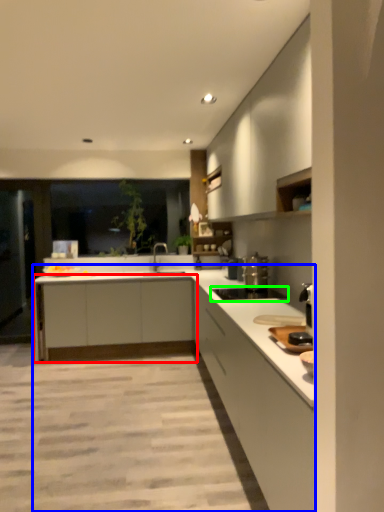
Question: Which is nearer to the cabinetry (highlighted by a red box)? countertop (highlighted by a blue box) or appliance (highlighted by a green box).

Choices:
 (A) countertop
 (B) appliance

Answer: (A)